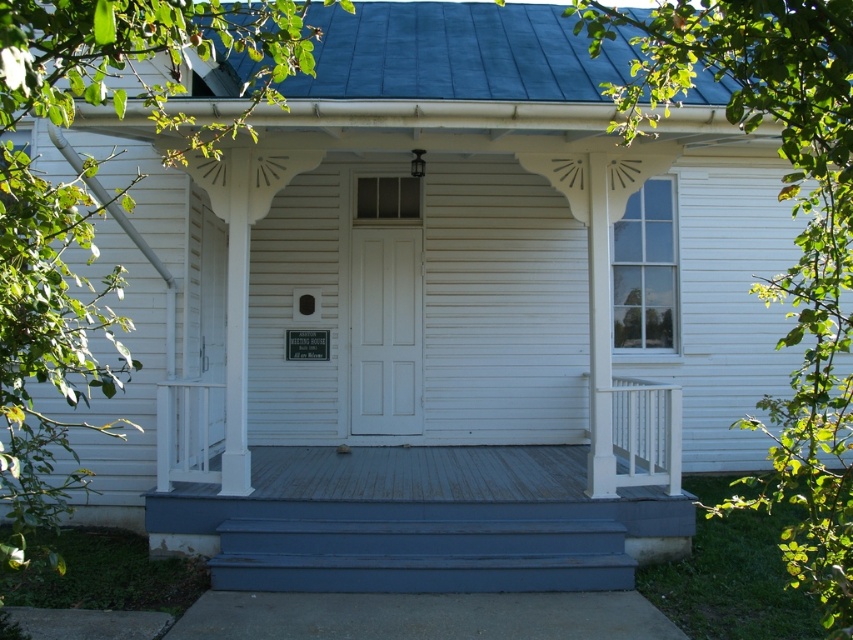
Which is more to the left, blue painted wood stairs at lower center or white painted wood door at center?

white painted wood door at center is more to the left.

Which of these two, blue painted wood stairs at lower center or white painted wood door at center, stands shorter?

blue painted wood stairs at lower center is shorter.

Consider the image. Who is more forward, (602,577) or (361,236)?

Positioned in front is point (602,577).

You are a GUI agent. You are given a task and a screenshot of the screen. Output one action in this format:
    pyautogui.click(x=<x>, y=<y>)
    Task: Click on the blue painted wood stairs at lower center
    
    Given the screenshot: What is the action you would take?
    pyautogui.click(x=421, y=556)